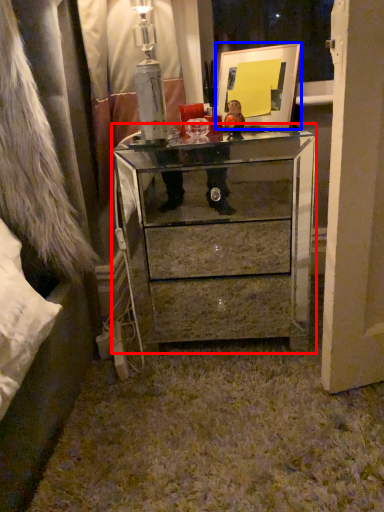
Question: Which of the following is the closest to the observer, chest of drawers (highlighted by a red box) or picture frame (highlighted by a blue box)?

Choices:
 (A) chest of drawers
 (B) picture frame

Answer: (A)